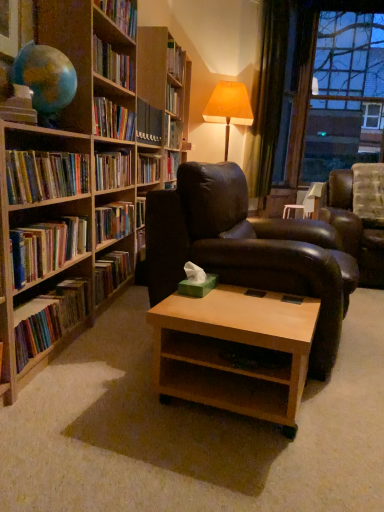
Question: Considering the relative sizes of leather couch at right and hardcover books at left, which is the third book from bottom to top, in the image provided, is leather couch at right smaller than hardcover books at left, which is the third book from bottom to top,?

Choices:
 (A) no
 (B) yes

Answer: (A)

Question: Can you confirm if leather couch at right is taller than hardcover books at left, which is the third book from bottom to top?

Choices:
 (A) yes
 (B) no

Answer: (A)

Question: Is leather couch at right located outside hardcover books at left, which is the third book from bottom to top?

Choices:
 (A) yes
 (B) no

Answer: (A)

Question: Considering the relative sizes of leather couch at right and hardcover books at left, the 1th book when ordered from top to bottom, in the image provided, is leather couch at right bigger than hardcover books at left, the 1th book when ordered from top to bottom,?

Choices:
 (A) yes
 (B) no

Answer: (A)

Question: Can you confirm if leather couch at right is positioned to the left of hardcover books at left, which is the third book from bottom to top?

Choices:
 (A) yes
 (B) no

Answer: (B)

Question: Considering the relative sizes of leather couch at right and hardcover books at left, the 1th book when ordered from top to bottom, in the image provided, is leather couch at right thinner than hardcover books at left, the 1th book when ordered from top to bottom,?

Choices:
 (A) yes
 (B) no

Answer: (B)

Question: Does wooden bookshelf at center contain multicolored paperbacks at left, which is the 1th book in bottom-to-top order?

Choices:
 (A) yes
 (B) no

Answer: (B)

Question: Can you confirm if wooden bookshelf at center is wider than multicolored paperbacks at left, which is the 1th book in bottom-to-top order?

Choices:
 (A) yes
 (B) no

Answer: (A)

Question: From a real-world perspective, is wooden bookshelf at center beneath multicolored paperbacks at left, which is the 1th book in bottom-to-top order?

Choices:
 (A) yes
 (B) no

Answer: (B)

Question: Is wooden bookshelf at center positioned in front of multicolored paperbacks at left, which is the 1th book in bottom-to-top order?

Choices:
 (A) yes
 (B) no

Answer: (B)

Question: From the image's perspective, is wooden bookshelf at center on multicolored paperbacks at left, which is the 1th book in bottom-to-top order?

Choices:
 (A) no
 (B) yes

Answer: (B)

Question: Considering the relative sizes of wooden bookshelf at center and multicolored paperbacks at left, which is the 1th book in bottom-to-top order, in the image provided, is wooden bookshelf at center smaller than multicolored paperbacks at left, which is the 1th book in bottom-to-top order,?

Choices:
 (A) yes
 (B) no

Answer: (B)

Question: Would you say wooden bookshelf at center contains hardcover books at left, the 1th book when ordered from top to bottom?

Choices:
 (A) yes
 (B) no

Answer: (B)